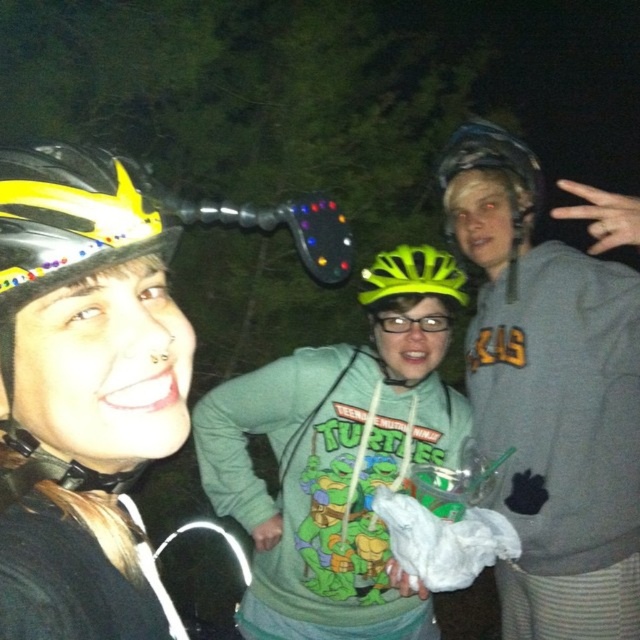
Question: Which of these objects is positioned farthest from the gray matte sweatshirt at center?

Choices:
 (A) green matte glasses at center
 (B) green matte helmet at center

Answer: (A)

Question: Is yellow shiny helmet at left below green matte helmet at center?

Choices:
 (A) yes
 (B) no

Answer: (A)

Question: Which of these objects is positioned closest to the green matte glasses at center?

Choices:
 (A) yellow matte bicycle helmet at left
 (B) yellow shiny helmet at left

Answer: (B)

Question: Is gray matte sweatshirt at center bigger than yellow shiny helmet at left?

Choices:
 (A) yes
 (B) no

Answer: (A)

Question: Which object appears closest to the camera in this image?

Choices:
 (A) green matte glasses at center
 (B) gray matte sweatshirt at center
 (C) green matte helmet at center

Answer: (B)

Question: Does gray matte sweatshirt at center have a greater width compared to yellow matte bicycle helmet at left?

Choices:
 (A) yes
 (B) no

Answer: (A)